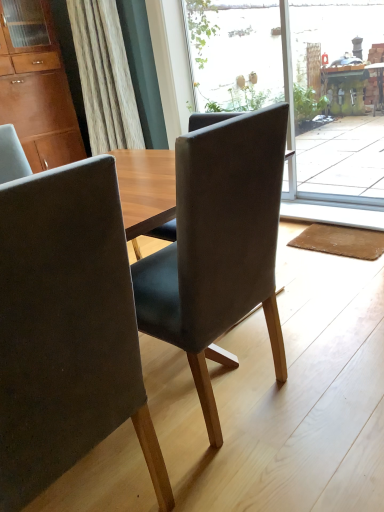
Find the location of a particular element. This screenshot has height=512, width=384. brown fabric mat at lower right is located at coordinates (341, 241).

The image size is (384, 512). What do you see at coordinates (38, 98) in the screenshot? I see `matte brown cabinet at upper left` at bounding box center [38, 98].

Where is `matte gray chair at center, which is counted as the 2th chair, starting from the right`? This screenshot has width=384, height=512. matte gray chair at center, which is counted as the 2th chair, starting from the right is located at coordinates (67, 330).

Locate an element on the screen. transparent glass door at center is located at coordinates tap(297, 81).

There is a brown fabric mat at lower right. Find the location of `the 2nd chair above it (from a real-world perspective)`. the 2nd chair above it (from a real-world perspective) is located at coordinates point(67,330).

Can you confirm if matte gray chair at center, the first chair viewed from the left, is smaller than brown fabric mat at lower right?

Incorrect, matte gray chair at center, the first chair viewed from the left, is not smaller in size than brown fabric mat at lower right.

From the picture: From the image's perspective, which is above, matte gray chair at center, the first chair viewed from the left, or brown fabric mat at lower right?

brown fabric mat at lower right, from the image's perspective.

Based on the photo, considering the relative positions of matte gray chair at center, the first chair viewed from the left, and brown fabric mat at lower right in the image provided, is matte gray chair at center, the first chair viewed from the left, to the left of brown fabric mat at lower right from the viewer's perspective?

Correct, you'll find matte gray chair at center, the first chair viewed from the left, to the left of brown fabric mat at lower right.

Does suede-like gray chair at center, positioned as the 1th chair in right-to-left order, touch matte brown cabinet at upper left?

No, suede-like gray chair at center, positioned as the 1th chair in right-to-left order, is not touching matte brown cabinet at upper left.

Can you confirm if suede-like gray chair at center, positioned as the 1th chair in right-to-left order, is bigger than matte brown cabinet at upper left?

Incorrect, suede-like gray chair at center, positioned as the 1th chair in right-to-left order, is not larger than matte brown cabinet at upper left.

From a real-world perspective, is suede-like gray chair at center, the 2th chair positioned from the left, on top of matte brown cabinet at upper left?

Actually, suede-like gray chair at center, the 2th chair positioned from the left, is physically below matte brown cabinet at upper left in the real world.

Is suede-like gray chair at center, the 2th chair positioned from the left, in front of or behind matte brown cabinet at upper left in the image?

Visually, suede-like gray chair at center, the 2th chair positioned from the left, is located in front of matte brown cabinet at upper left.

Could you tell me if matte gray chair at center, which is counted as the 2th chair, starting from the right, is facing transparent glass screen door at upper right?

No, matte gray chair at center, which is counted as the 2th chair, starting from the right, is not aimed at transparent glass screen door at upper right.

From the image's perspective, between matte gray chair at center, the first chair viewed from the left, and transparent glass screen door at upper right, who is located below?

matte gray chair at center, the first chair viewed from the left.

Is point (157, 480) positioned behind point (318, 26)?

That is False.

Considering the sizes of objects matte gray chair at center, the first chair viewed from the left, and transparent glass screen door at upper right in the image provided, who is smaller, matte gray chair at center, the first chair viewed from the left, or transparent glass screen door at upper right?

Smaller between the two is transparent glass screen door at upper right.

Is matte gray chair at center, the first chair viewed from the left, not near matte brown cabinet at upper left?

Yes, matte gray chair at center, the first chair viewed from the left, and matte brown cabinet at upper left are located far from each other.

This screenshot has height=512, width=384. What are the coordinates of `cabinetry above the matte gray chair at center, which is counted as the 2th chair, starting from the right (from the image's perspective)` in the screenshot? It's located at coord(38,98).

From the image's perspective, relative to matte brown cabinet at upper left, is matte gray chair at center, the first chair viewed from the left, above or below?

Based on their image positions, matte gray chair at center, the first chair viewed from the left, is located beneath matte brown cabinet at upper left.

Does point (55, 227) appear closer or farther from the camera than point (68, 128)?

Clearly, point (55, 227) is closer to the camera than point (68, 128).

Between transparent glass door at center and suede-like gray chair at center, the 2th chair positioned from the left, which one appears on the left side from the viewer's perspective?

suede-like gray chair at center, the 2th chair positioned from the left.

Is transparent glass door at center facing towards suede-like gray chair at center, the 2th chair positioned from the left?

No, transparent glass door at center is not aimed at suede-like gray chair at center, the 2th chair positioned from the left.

Where is `glass door above the suede-like gray chair at center, the 2th chair positioned from the left (from the image's perspective)`? The image size is (384, 512). glass door above the suede-like gray chair at center, the 2th chair positioned from the left (from the image's perspective) is located at coordinates (297, 81).

Does point (222, 96) appear closer or farther from the camera than point (272, 316)?

Point (222, 96) appears to be farther away from the viewer than point (272, 316).

From a real-world perspective, who is located higher, transparent glass screen door at upper right or transparent glass door at center?

transparent glass door at center is physically above.

Is transparent glass screen door at upper right not inside transparent glass door at center?

Absolutely, transparent glass screen door at upper right is external to transparent glass door at center.

Considering the points (360, 20) and (240, 106), which point is in front, point (360, 20) or point (240, 106)?

The point (240, 106) is more forward.

How many degrees apart are the facing directions of brown fabric mat at lower right and matte brown cabinet at upper left?

The angle between the facing direction of brown fabric mat at lower right and the facing direction of matte brown cabinet at upper left is 88.6 degrees.

In the scene shown: Does brown fabric mat at lower right have a greater height compared to matte brown cabinet at upper left?

In fact, brown fabric mat at lower right may be shorter than matte brown cabinet at upper left.

Can we say brown fabric mat at lower right lies outside matte brown cabinet at upper left?

Absolutely, brown fabric mat at lower right is external to matte brown cabinet at upper left.

Is matte brown cabinet at upper left at the back of brown fabric mat at lower right?

That's not correct — brown fabric mat at lower right is not looking away from matte brown cabinet at upper left.

The image size is (384, 512). I want to click on mat on the right of the matte gray chair at center, the first chair viewed from the left, so click(x=341, y=241).

Find the location of a particular element. This screenshot has height=512, width=384. chair that is the 1st one when counting forward from the matte brown cabinet at upper left is located at coordinates (218, 245).

In the scene shown: Estimate the real-world distances between objects in this image. Which object is further from brown fabric mat at lower right, matte gray chair at center, the first chair viewed from the left, or transparent glass door at center?

The object further to brown fabric mat at lower right is matte gray chair at center, the first chair viewed from the left.

From the image, which object appears to be farther from transparent glass door at center, matte gray chair at center, which is counted as the 2th chair, starting from the right, or brown fabric mat at lower right?

The object further to transparent glass door at center is matte gray chair at center, which is counted as the 2th chair, starting from the right.

Based on their spatial positions, is brown fabric mat at lower right or matte brown cabinet at upper left closer to transparent glass screen door at upper right?

brown fabric mat at lower right is closer to transparent glass screen door at upper right.

When comparing their distances from matte gray chair at center, which is counted as the 2th chair, starting from the right, does matte brown cabinet at upper left or transparent glass screen door at upper right seem closer?

matte brown cabinet at upper left lies closer to matte gray chair at center, which is counted as the 2th chair, starting from the right, than the other object.

When comparing their distances from suede-like gray chair at center, positioned as the 1th chair in right-to-left order, does brown fabric mat at lower right or transparent glass door at center seem further?

transparent glass door at center is positioned further to the anchor suede-like gray chair at center, positioned as the 1th chair in right-to-left order.

From the image, which object appears to be farther from transparent glass door at center, brown fabric mat at lower right or matte gray chair at center, which is counted as the 2th chair, starting from the right?

matte gray chair at center, which is counted as the 2th chair, starting from the right.

Estimate the real-world distances between objects in this image. Which object is further from transparent glass screen door at upper right, matte brown cabinet at upper left or brown fabric mat at lower right?

matte brown cabinet at upper left is further to transparent glass screen door at upper right.

Looking at the image, which one is located closer to matte brown cabinet at upper left, brown fabric mat at lower right or transparent glass door at center?

brown fabric mat at lower right is closer to matte brown cabinet at upper left.

The image size is (384, 512). I want to click on glass door located between matte brown cabinet at upper left and brown fabric mat at lower right in the left-right direction, so click(297, 81).

Locate an element on the screen. chair positioned between matte gray chair at center, which is counted as the 2th chair, starting from the right, and transparent glass screen door at upper right from near to far is located at coordinates (218, 245).

Locate an element on the screen. This screenshot has height=512, width=384. mat between matte gray chair at center, which is counted as the 2th chair, starting from the right, and matte brown cabinet at upper left from front to back is located at coordinates (341, 241).

Where is `glass door situated between matte brown cabinet at upper left and transparent glass screen door at upper right from left to right`? glass door situated between matte brown cabinet at upper left and transparent glass screen door at upper right from left to right is located at coordinates [x=297, y=81].